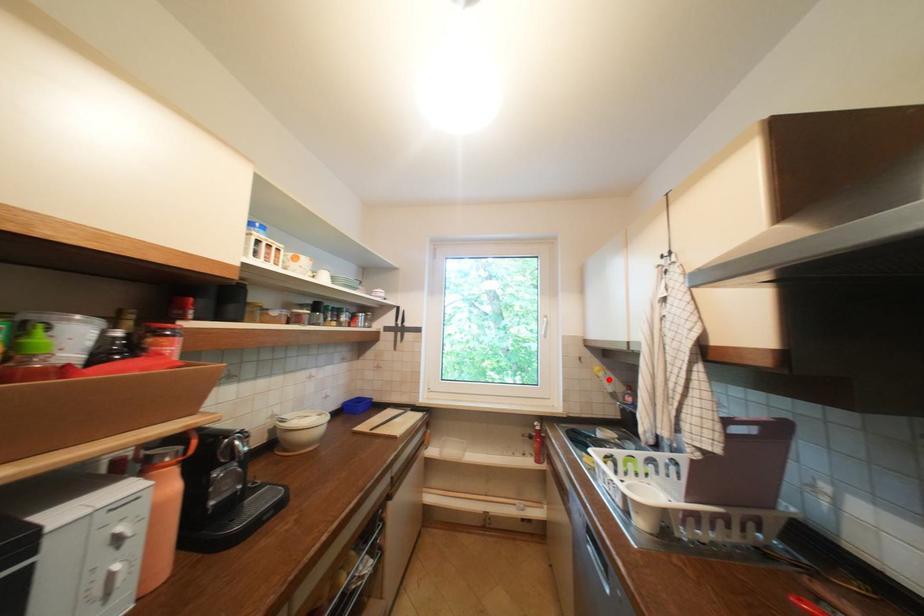
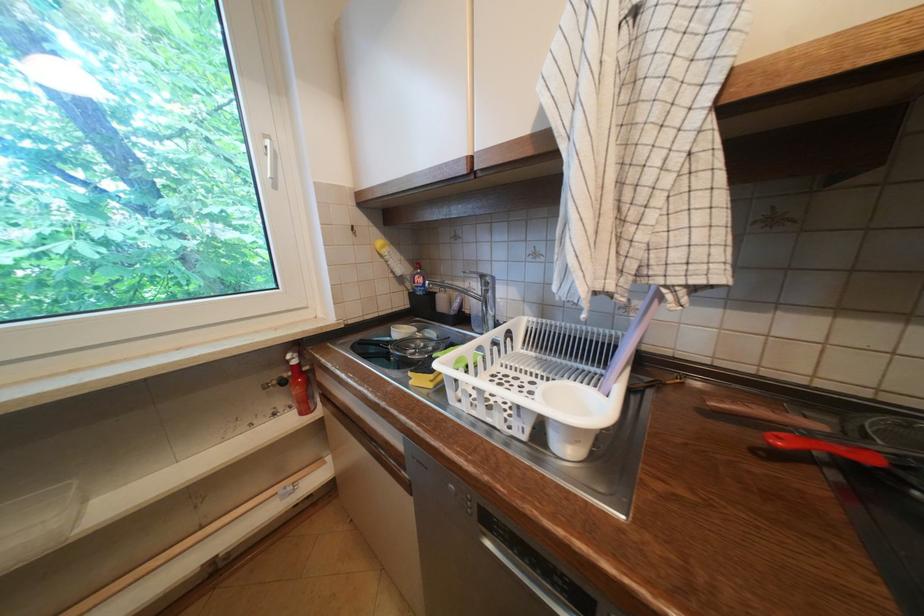
Question: I am providing you with two images of the same scene from different viewpoints. Image1 has a red point marked. In image2, the corresponding 3D location appears at what relative position? Reply with the corresponding letter.

Choices:
 (A) Closer
 (B) Farther

Answer: (A)